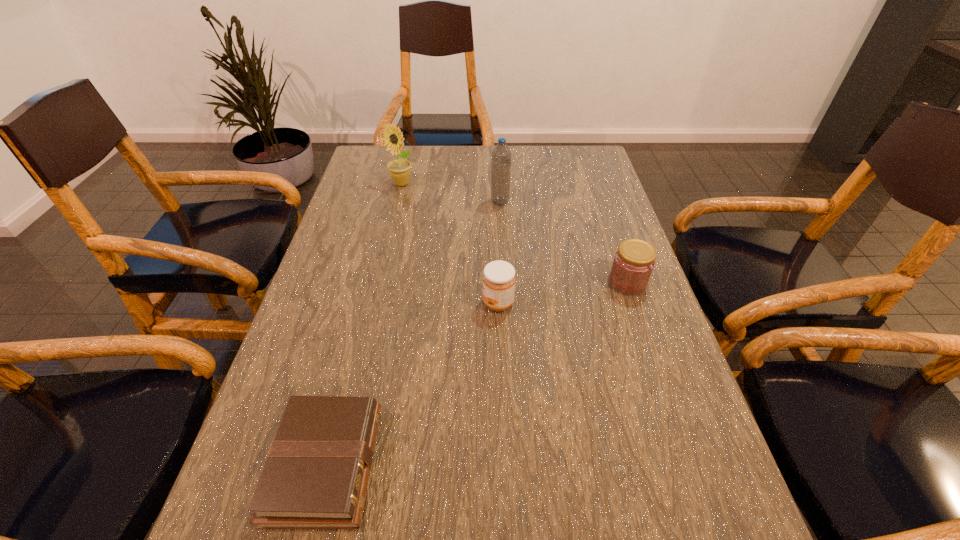
At what (x,y) coordinates should I click in order to perform the action: click on vacant space at the right edge. Please return your answer as a coordinate pair (x, y). This screenshot has height=540, width=960. Looking at the image, I should click on (607, 196).

This screenshot has height=540, width=960. Identify the location of free location at the far left corner of the desktop. (401, 152).

The height and width of the screenshot is (540, 960). In order to click on empty location between the farthest object and the water bottle in this screenshot , I will do `click(450, 193)`.

Find the location of a particular element. empty location between the rightmost object and the left jam is located at coordinates (563, 293).

Image resolution: width=960 pixels, height=540 pixels. Identify the location of vacant space in between the water bottle and the right jam. (564, 242).

This screenshot has width=960, height=540. Find the location of `vacant area between the left jam and the sunflower`. vacant area between the left jam and the sunflower is located at coordinates (449, 244).

Locate an element on the screen. The height and width of the screenshot is (540, 960). free space between the left jam and the water bottle is located at coordinates (499, 253).

I want to click on empty location between the left jam and the sunflower, so click(449, 244).

The width and height of the screenshot is (960, 540). What are the coordinates of `vacant point located between the right jam and the sunflower` in the screenshot? It's located at (515, 233).

At what (x,y) coordinates should I click in order to perform the action: click on empty location between the left jam and the farthest object. Please return your answer as a coordinate pair (x, y). Looking at the image, I should click on (449, 244).